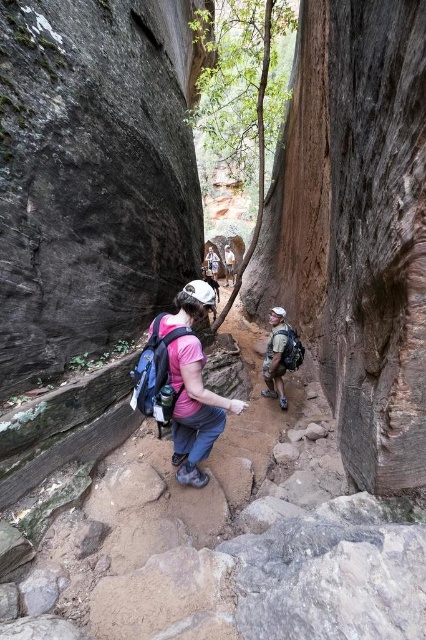
Is matte pink shirt at center positioned in front of matte gray backpack at center?

Yes, matte pink shirt at center is closer to the viewer.

Can you confirm if matte pink shirt at center is positioned above matte gray backpack at center?

No.

Between point (210, 440) and point (296, 362), which one is positioned in front?

Point (210, 440)

The height and width of the screenshot is (640, 426). I want to click on matte pink shirt at center, so (193, 410).